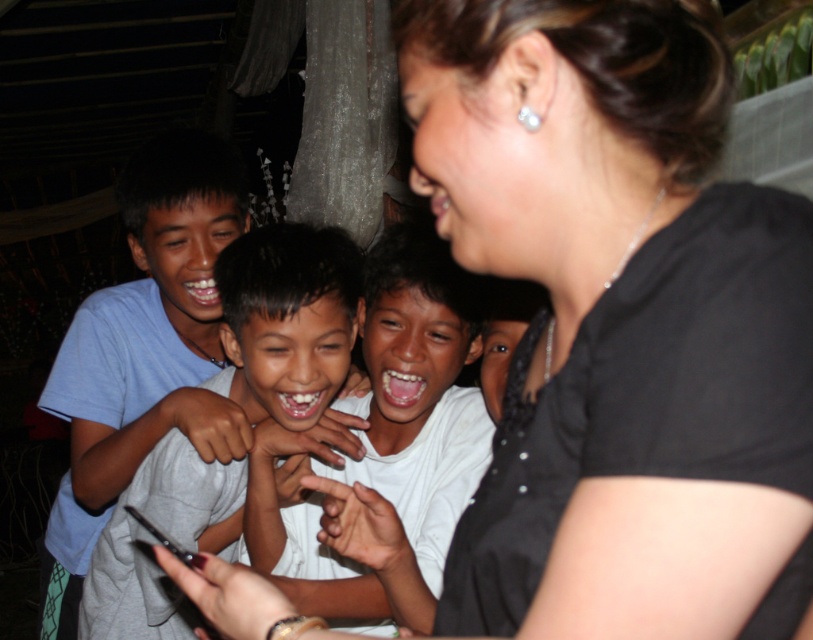
In the scene, there are two shirts at the center of the image. The smooth white shirt at center and the gray matte shirt at center. From the perspective of someone facing the scene, which shirt is positioned to the right?

The smooth white shirt at center is positioned to the right of the gray matte shirt at center.